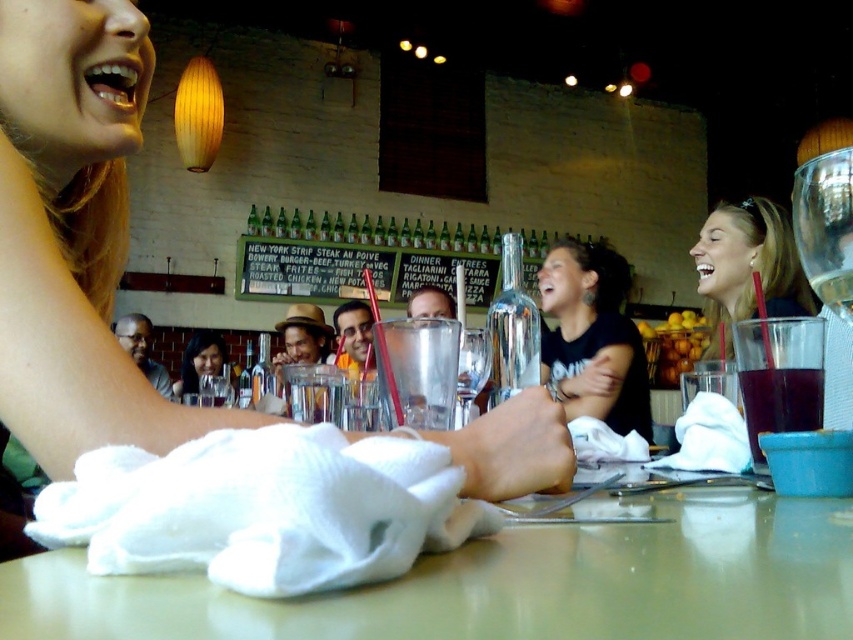
Identify the location of matte black hair at upper right. The image size is (853, 640). (747, 268).

Is matte black hair at upper right above translucent plastic cup at lower right?

Indeed, matte black hair at upper right is positioned over translucent plastic cup at lower right.

Who is more distant from viewer, (810, 312) or (759, 400)?

Point (810, 312)

The image size is (853, 640). What are the coordinates of `matte black hair at upper right` in the screenshot? It's located at (747, 268).

Describe the element at coordinates (74, 234) in the screenshot. I see `white towel at lower center` at that location.

Does point (22, 176) come farther from viewer compared to point (712, 262)?

No, it is in front of (712, 262).

At what (x,y) coordinates should I click in order to perform the action: click on white towel at lower center. Please return your answer as a coordinate pair (x, y). Looking at the image, I should click on (74, 234).

Between white towel at lower center and matte black hair at center, which one has less height?

matte black hair at center

Is point (62, 186) positioned in front of point (196, 344)?

Yes, point (62, 186) is closer to viewer.

Locate an element on the screen. Image resolution: width=853 pixels, height=640 pixels. white towel at lower center is located at coordinates (74, 234).